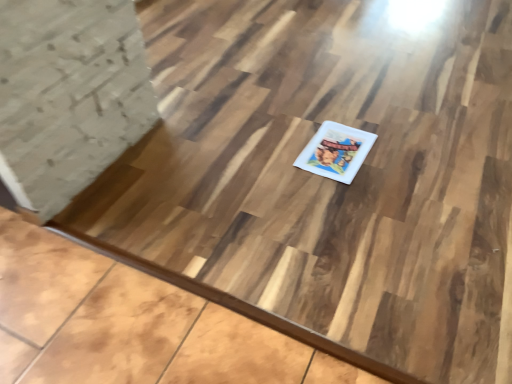
Question: Should I look upward or downward to see white glossy book at center?

Choices:
 (A) up
 (B) down

Answer: (A)